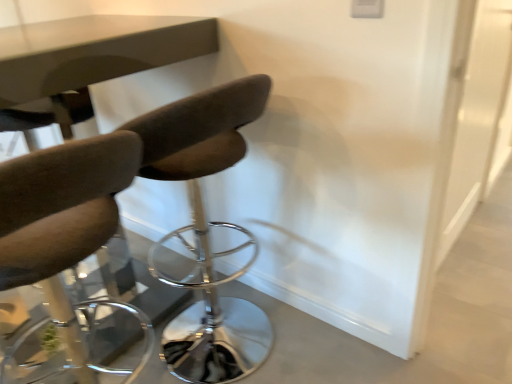
Question: From a real-world perspective, is transparent glass door at right positioned over matte brown chair at left, the second chair positioned from the right, based on gravity?

Choices:
 (A) yes
 (B) no

Answer: (A)

Question: Is transparent glass door at right beside matte brown chair at left, the 1th chair from the left?

Choices:
 (A) no
 (B) yes

Answer: (A)

Question: Does transparent glass door at right have a lesser width compared to matte brown chair at left, the second chair positioned from the right?

Choices:
 (A) no
 (B) yes

Answer: (B)

Question: Considering the relative positions of transparent glass door at right and matte brown chair at left, the 1th chair from the left, in the image provided, is transparent glass door at right to the left of matte brown chair at left, the 1th chair from the left, from the viewer's perspective?

Choices:
 (A) no
 (B) yes

Answer: (A)

Question: Does transparent glass door at right have a smaller size compared to matte brown chair at left, the second chair positioned from the right?

Choices:
 (A) yes
 (B) no

Answer: (A)

Question: Considering the relative sizes of transparent glass door at right and matte brown chair at left, the second chair positioned from the right, in the image provided, is transparent glass door at right bigger than matte brown chair at left, the second chair positioned from the right,?

Choices:
 (A) yes
 (B) no

Answer: (B)

Question: Is matte brown chair at left, the 1th chair from the left, placed right next to dark brown leather chair at center, the 1th chair from the right?

Choices:
 (A) yes
 (B) no

Answer: (B)

Question: Would you say matte brown chair at left, the second chair positioned from the right, is outside dark brown leather chair at center, the 1th chair from the right?

Choices:
 (A) yes
 (B) no

Answer: (A)

Question: Is matte brown chair at left, the second chair positioned from the right, positioned behind dark brown leather chair at center, arranged as the second chair when viewed from the left?

Choices:
 (A) no
 (B) yes

Answer: (A)

Question: From a real-world perspective, is matte brown chair at left, the 1th chair from the left, located beneath dark brown leather chair at center, the 1th chair from the right?

Choices:
 (A) yes
 (B) no

Answer: (B)

Question: Is matte brown chair at left, the 1th chair from the left, taller than dark brown leather chair at center, arranged as the second chair when viewed from the left?

Choices:
 (A) yes
 (B) no

Answer: (B)

Question: Does matte brown chair at left, the 1th chair from the left, have a greater width compared to dark brown leather chair at center, the 1th chair from the right?

Choices:
 (A) no
 (B) yes

Answer: (A)

Question: Is matte brown chair at left, the second chair positioned from the right, bigger than transparent glass door at right?

Choices:
 (A) no
 (B) yes

Answer: (B)